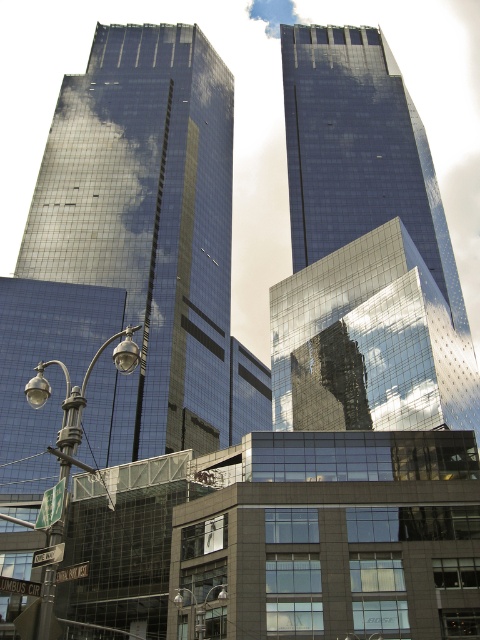
You are a city planner assessing the width of streetlights for maintenance. Given the polished metal streetlight at lower left and the metallic silver streetlight at lower center, which one is wider?

The polished metal streetlight at lower left is wider than the metallic silver streetlight at lower center according to the description.

What are the coordinates of the shiny glass skyscraper at center?

The coordinates of the shiny glass skyscraper at center are at point (147, 221).